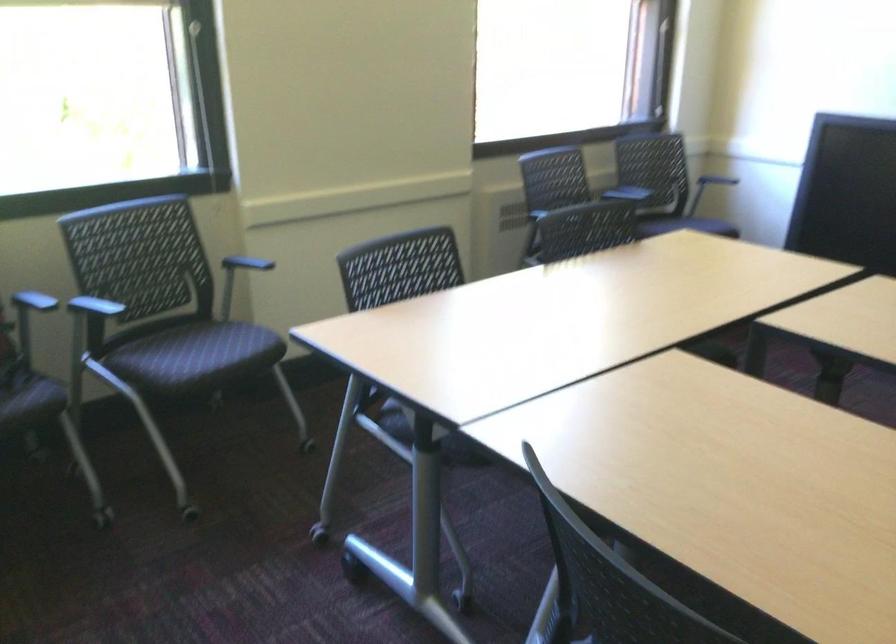
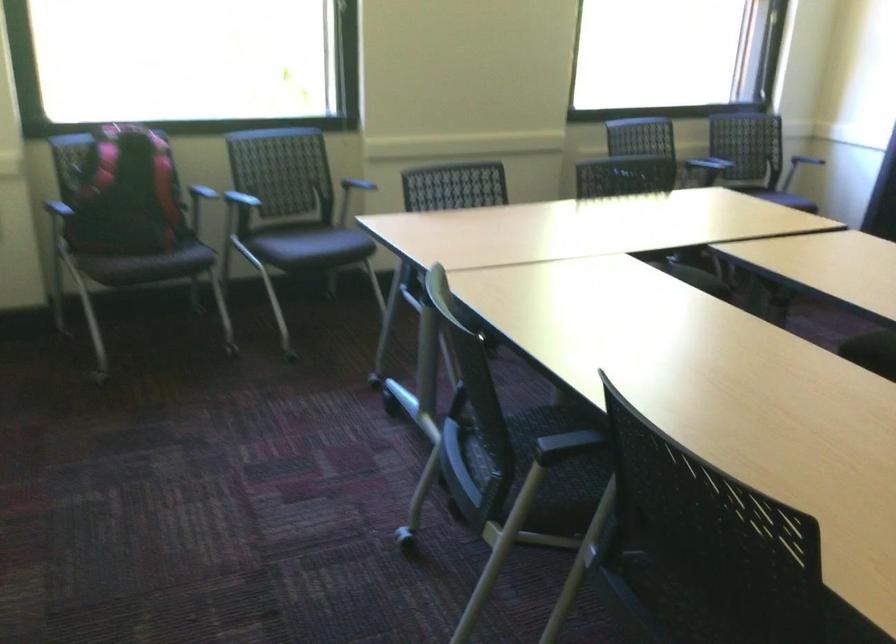
The point at [219,355] is marked in the first image. Where is the corresponding point in the second image?

(323, 243)